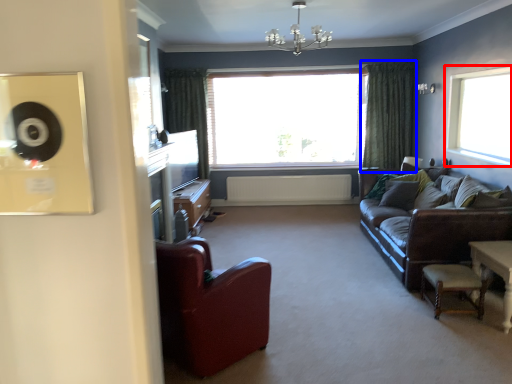
Question: Which object is further to the camera taking this photo, window (highlighted by a red box) or curtain (highlighted by a blue box)?

Choices:
 (A) window
 (B) curtain

Answer: (B)